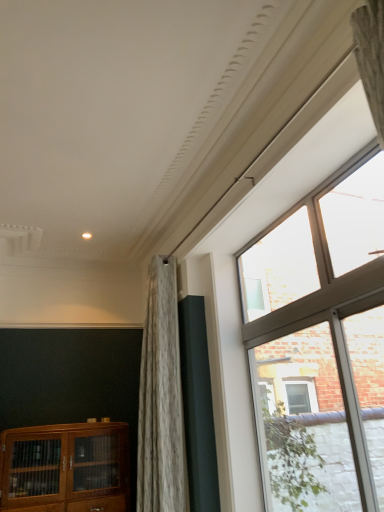
I want to click on free space above clear glass window at upper right (from a real-world perspective), so click(297, 202).